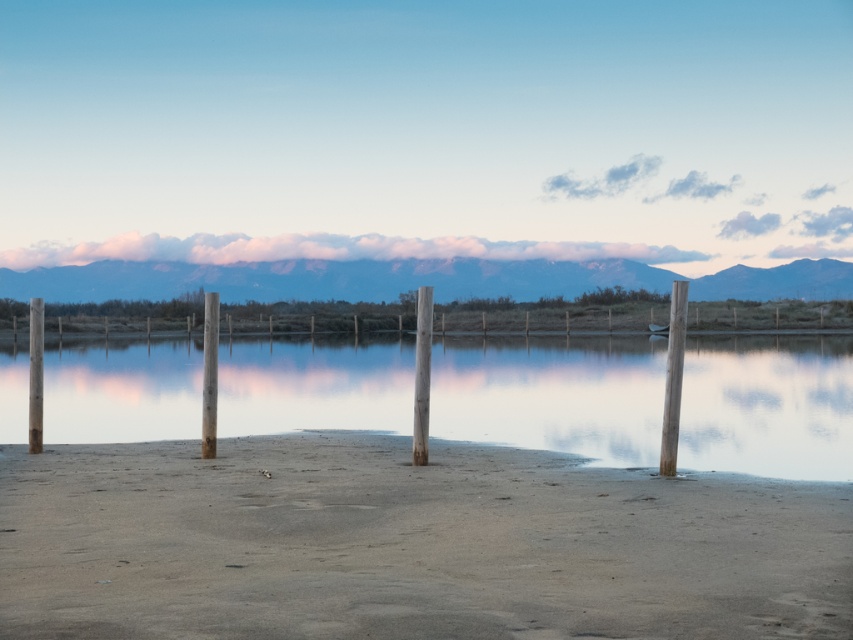
Question: Is smooth wood post at right positioned behind smooth wood post at left?

Choices:
 (A) no
 (B) yes

Answer: (A)

Question: Which point is farther to the camera?

Choices:
 (A) click(207, 368)
 (B) click(345, 348)
 (C) click(585, 592)

Answer: (B)

Question: Which point is farther from the camera taking this photo?

Choices:
 (A) (73, 596)
 (B) (668, 396)

Answer: (B)

Question: Does smooth reflective water at center have a smaller size compared to smooth wood post at right?

Choices:
 (A) no
 (B) yes

Answer: (A)

Question: Is sandy at lower center bigger than smooth wood post at center?

Choices:
 (A) yes
 (B) no

Answer: (A)

Question: Estimate the real-world distances between objects in this image. Which object is closer to the sandy at lower center?

Choices:
 (A) smooth wood post at center
 (B) wooden post at center

Answer: (A)